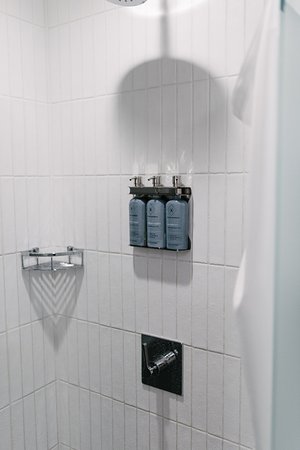
In order to click on shampoo dispenser in this screenshot , I will do `click(150, 214)`.